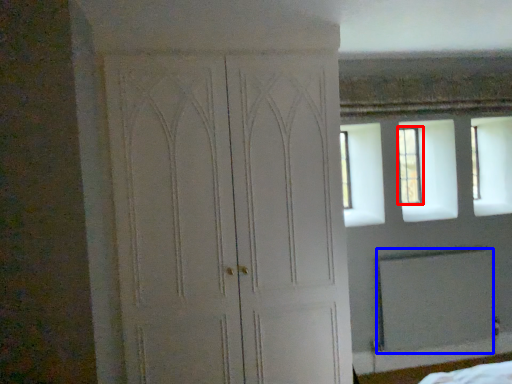
Question: Which object is further to the camera taking this photo, window (highlighted by a red box) or screen door (highlighted by a blue box)?

Choices:
 (A) window
 (B) screen door

Answer: (A)